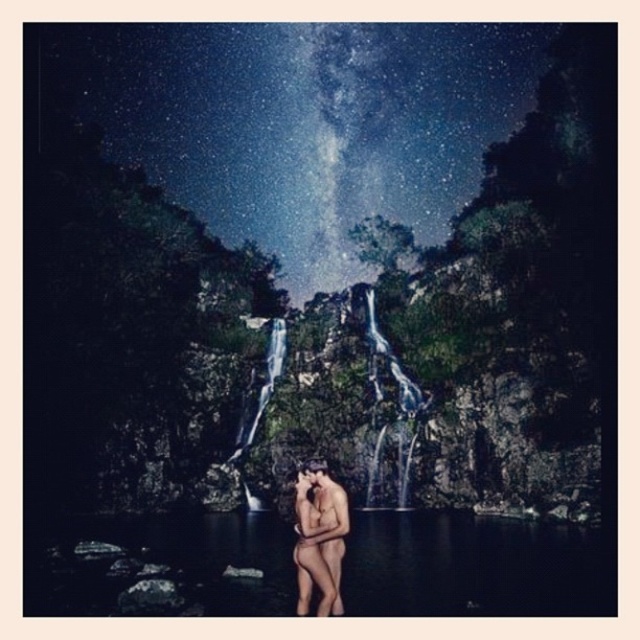
Question: Which of the following is the closest to the observer?

Choices:
 (A) (321, 554)
 (B) (552, 532)

Answer: (A)

Question: Does transparent water at center appear on the left side of smooth skin man at center?

Choices:
 (A) yes
 (B) no

Answer: (A)

Question: Considering the relative positions of transparent water at center and smooth skin man at center in the image provided, where is transparent water at center located with respect to smooth skin man at center?

Choices:
 (A) above
 (B) below

Answer: (B)

Question: Can you confirm if transparent water at center is positioned above smooth skin man at center?

Choices:
 (A) no
 (B) yes

Answer: (A)

Question: Which of the following is the farthest from the observer?

Choices:
 (A) transparent water at center
 (B) smooth skin man at center

Answer: (B)